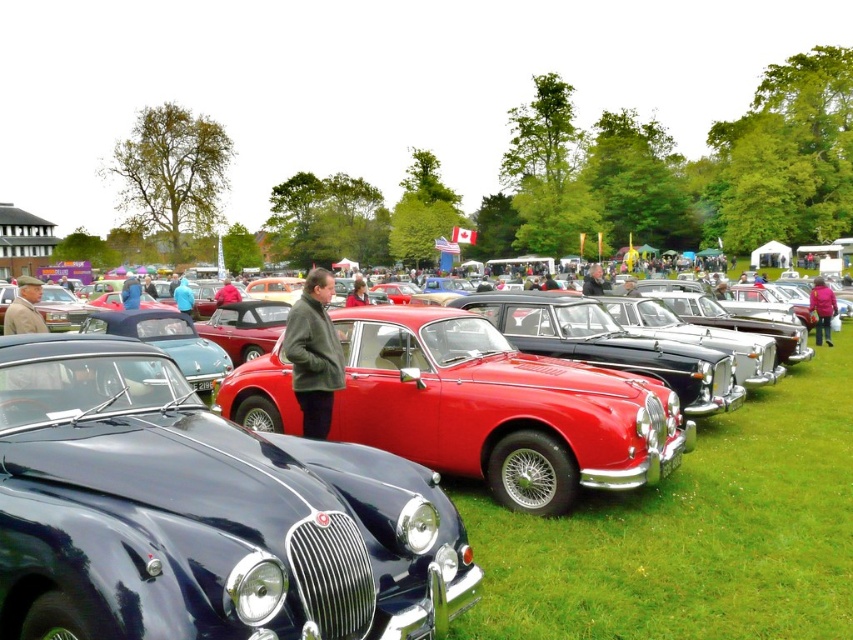
You are a photographer standing at the edge of the car show field. You want to take a photo that includes both the green wool coat at center and the blue fabric jacket at center. What is the minimum distance you need to move backward to ensure both items are in frame?

The green wool coat at center and blue fabric jacket at center are 9.08 meters apart. To include both in the photo, you need to move backward until the camera can capture a field of view that spans at least 9.08 meters. The exact distance depends on the camera lens, but generally, moving back several meters should suffice.

You are a photographer standing at the edge of the car show field. You want to take a photo of both the shiny red car at center and the pink fabric jacket at center in the same frame. Which object should you position closer to the left side of your camera viewfinder to include both in the shot?

To include both the shiny red car at center and the pink fabric jacket at center in the same frame, you should position the shiny red car at center closer to the left side of your camera viewfinder since it is already to the left of the pink fabric jacket at center.

You are a photographer standing in the middle of the car show. You want to take a picture of both the shiny red car at center and the green wool coat at center. Which object should you move towards to get both in the frame?

You should move towards the green wool coat at center because the shiny red car at center is to the right of it, so positioning yourself closer to the coat will allow both objects to be captured in the frame.